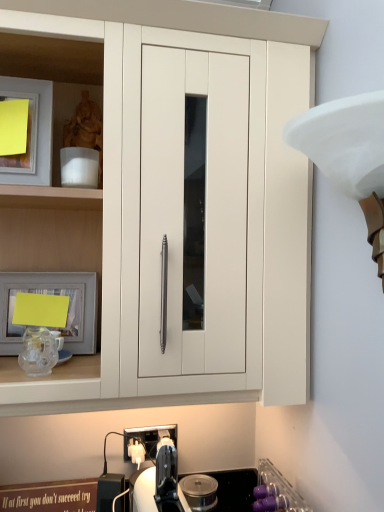
Question: Is white matte lampshade at upper right positioned with its back to matte silver picture frame at left?

Choices:
 (A) no
 (B) yes

Answer: (A)

Question: From a real-world perspective, is white matte lampshade at upper right under matte silver picture frame at left?

Choices:
 (A) no
 (B) yes

Answer: (A)

Question: Can you confirm if white matte lampshade at upper right is thinner than matte silver picture frame at left?

Choices:
 (A) no
 (B) yes

Answer: (A)

Question: Does white matte lampshade at upper right have a greater height compared to matte silver picture frame at left?

Choices:
 (A) yes
 (B) no

Answer: (A)

Question: Is white matte lampshade at upper right outside matte silver picture frame at left?

Choices:
 (A) yes
 (B) no

Answer: (A)

Question: From a real-world perspective, is purple plastic cups at lower right physically located above or below matte white cabinet at center?

Choices:
 (A) above
 (B) below

Answer: (B)

Question: Is purple plastic cups at lower right spatially inside matte white cabinet at center, or outside of it?

Choices:
 (A) inside
 (B) outside

Answer: (B)

Question: Considering the relative positions of purple plastic cups at lower right and matte white cabinet at center in the image provided, is purple plastic cups at lower right to the left or to the right of matte white cabinet at center?

Choices:
 (A) right
 (B) left

Answer: (A)

Question: Considering their positions, is purple plastic cups at lower right located in front of or behind matte white cabinet at center?

Choices:
 (A) front
 (B) behind

Answer: (B)

Question: Looking at the image, does purple plastic cups at lower right seem bigger or smaller compared to matte silver picture frame at left?

Choices:
 (A) big
 (B) small

Answer: (A)

Question: From a real-world perspective, is purple plastic cups at lower right positioned above or below matte silver picture frame at left?

Choices:
 (A) above
 (B) below

Answer: (B)

Question: Looking at their shapes, would you say purple plastic cups at lower right is wider or thinner than matte silver picture frame at left?

Choices:
 (A) wide
 (B) thin

Answer: (A)

Question: In the image, is purple plastic cups at lower right positioned in front of or behind matte silver picture frame at left?

Choices:
 (A) front
 (B) behind

Answer: (A)

Question: Is white matte lampshade at upper right wider or thinner than purple plastic cups at lower right?

Choices:
 (A) thin
 (B) wide

Answer: (A)

Question: From the image's perspective, is white matte lampshade at upper right located above or below purple plastic cups at lower right?

Choices:
 (A) above
 (B) below

Answer: (A)